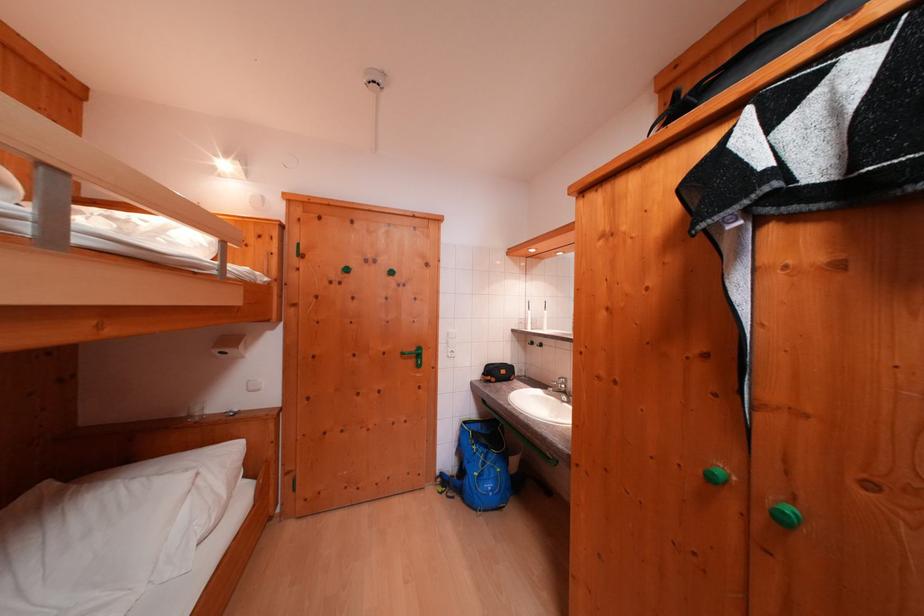
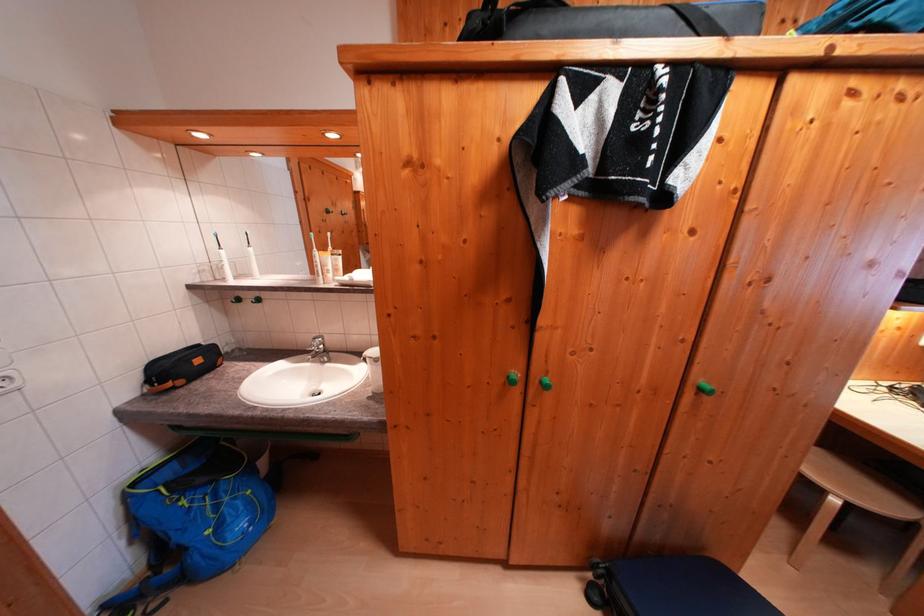
The images are taken continuously from a first-person perspective. In which direction is your viewpoint rotating?

The rotation direction of the camera is right-down.